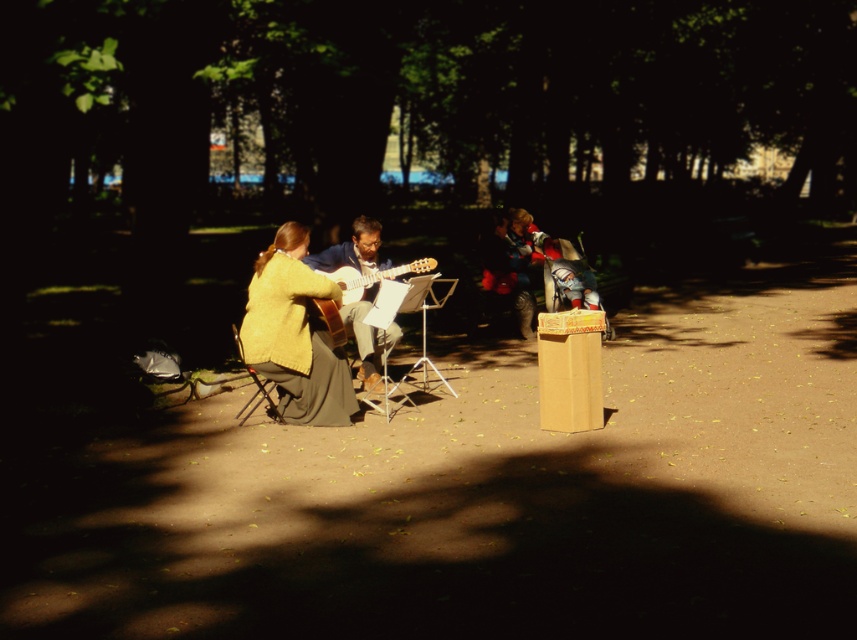
Looking at this image, which is more to the right, matte yellow sweater at center or light brown wooden guitar at center?

Positioned to the right is light brown wooden guitar at center.

In the scene shown: Who is more forward, (343, 394) or (372, 280)?

Positioned in front is point (343, 394).

Where is `matte yellow sweater at center`? The height and width of the screenshot is (640, 857). matte yellow sweater at center is located at coordinates (294, 333).

Which is in front, point (363, 324) or point (273, 404)?

Point (273, 404) is more forward.

Between matte brown guitar at center and wooden folding chair at lower left, which one appears on the right side from the viewer's perspective?

matte brown guitar at center is more to the right.

Find the location of `matte brown guitar at center`. matte brown guitar at center is located at coordinates (352, 250).

Which of these two, light brown wooden guitar at center or wooden folding chair at lower left, stands shorter?

light brown wooden guitar at center

Which of these two, light brown wooden guitar at center or wooden folding chair at lower left, stands taller?

Standing taller between the two is wooden folding chair at lower left.

Is point (352, 285) positioned in front of point (255, 396)?

No, (352, 285) is further to viewer.

Locate an element on the screen. This screenshot has height=640, width=857. light brown wooden guitar at center is located at coordinates (370, 276).